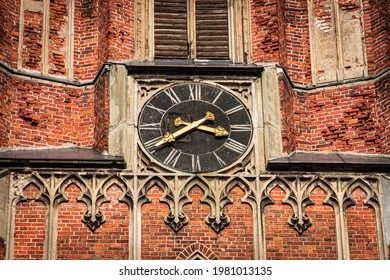
Where is `clock hour hand`? clock hour hand is located at coordinates (214, 128).